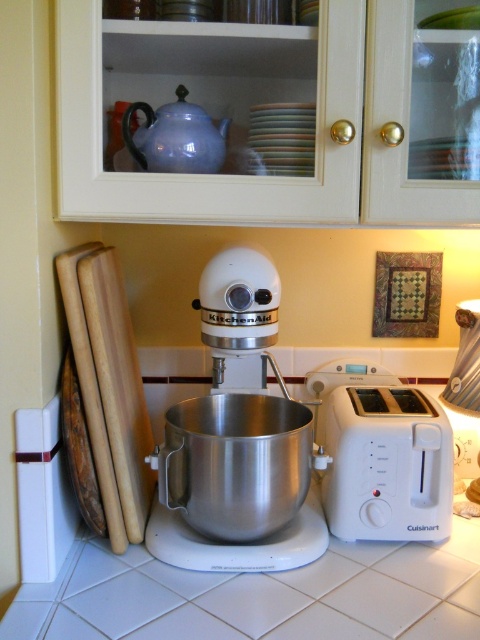
Question: Does white plastic toaster at right appear over matte blue teapot at upper center?

Choices:
 (A) no
 (B) yes

Answer: (A)

Question: Does white plastic toaster at right appear on the left side of matte blue teapot at upper center?

Choices:
 (A) yes
 (B) no

Answer: (B)

Question: Which object is farther from the camera taking this photo?

Choices:
 (A) white matte kitchenaid mixer at center
 (B) matte blue teapot at upper center
 (C) white plastic toaster at right

Answer: (C)

Question: Among these points, which one is nearest to the camera?

Choices:
 (A) (312, 531)
 (B) (432, 417)

Answer: (A)

Question: Considering the real-world distances, which object is closest to the white plastic toaster at right?

Choices:
 (A) white matte kitchenaid mixer at center
 (B) matte blue teapot at upper center

Answer: (A)

Question: Does white matte kitchenaid mixer at center appear on the left side of matte blue teapot at upper center?

Choices:
 (A) yes
 (B) no

Answer: (B)